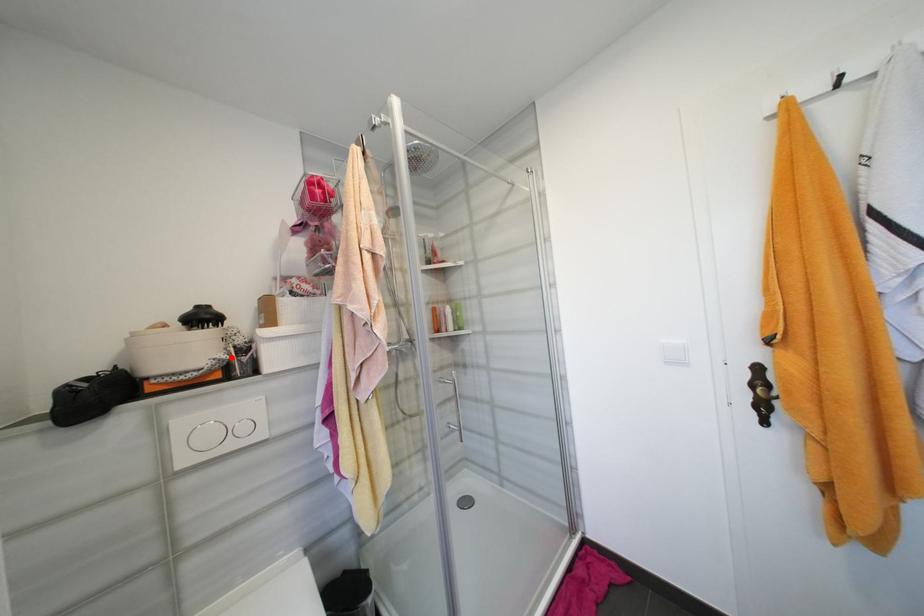
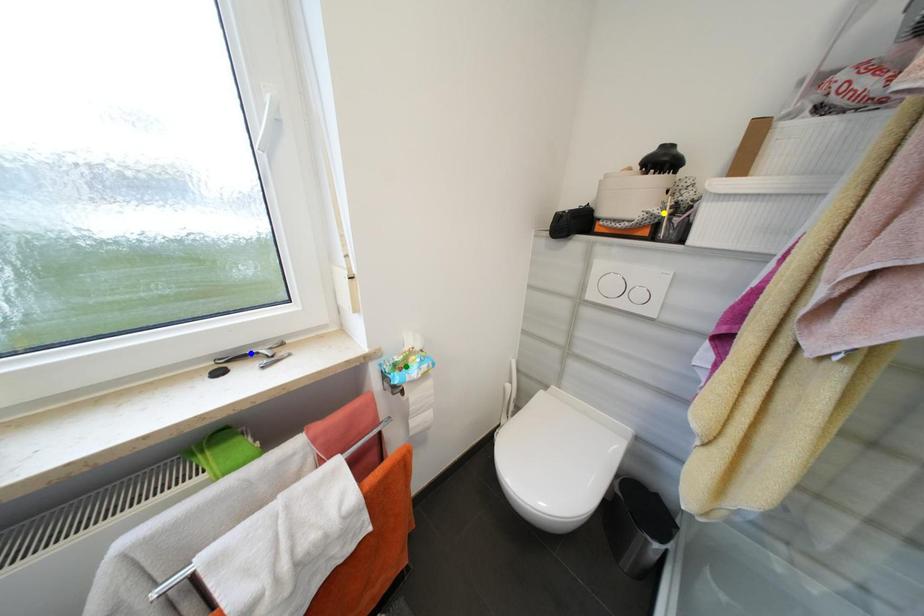
Question: I am providing you with two images of the same scene from different viewpoints. A red point is marked on the first image. You are given multiple points on the second image. Which point in image 2 represents the same 3d spot as the red point in image 1?

Choices:
 (A) yellow point
 (B) blue point
 (C) green point

Answer: (A)